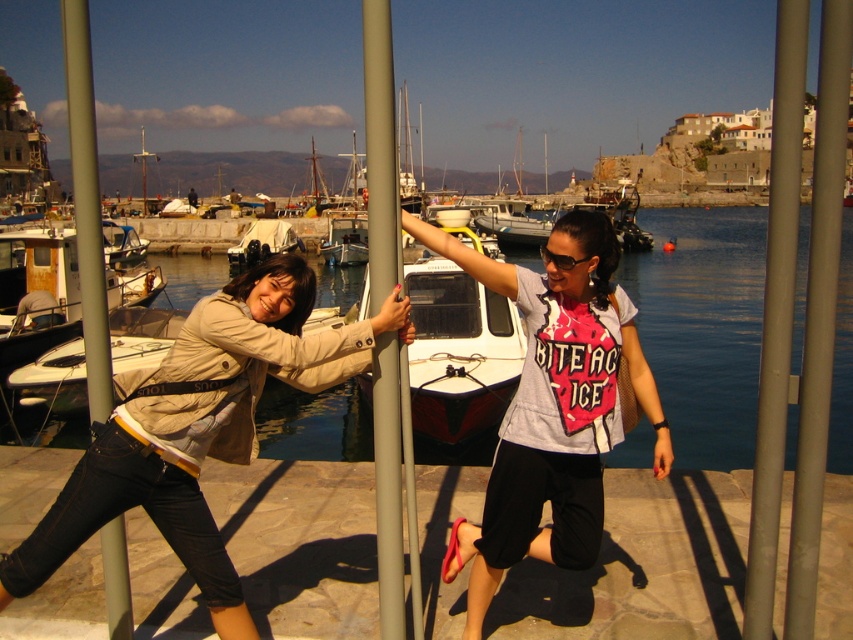
You are standing at the marina and see the khaki fabric jacket at left and the metallic gray pole at center. Which object is positioned more to the left side of the image?

The khaki fabric jacket at left is positioned more to the left side of the image compared to the metallic gray pole at center, as it is located to the left of it.

You are a photographer trying to capture the blue water at center in your shot. Based on the scene description, what are the coordinates where you should focus your camera?

The coordinates for the blue water at center are at point (703,326).

You are a photographer standing at the center of the marina, and you want to take a photo that includes both the metallic gray pole at right and the rusty metal boat at left. Given that your camera has a maximum zoom range of 50 meters, will you be able to capture both objects in a single frame without moving closer?

The metallic gray pole at right is 43.60 meters from the rusty metal boat at left. Since the distance between them is within the camera maximum zoom range of 50 meters, you can capture both objects in a single frame without moving closer.